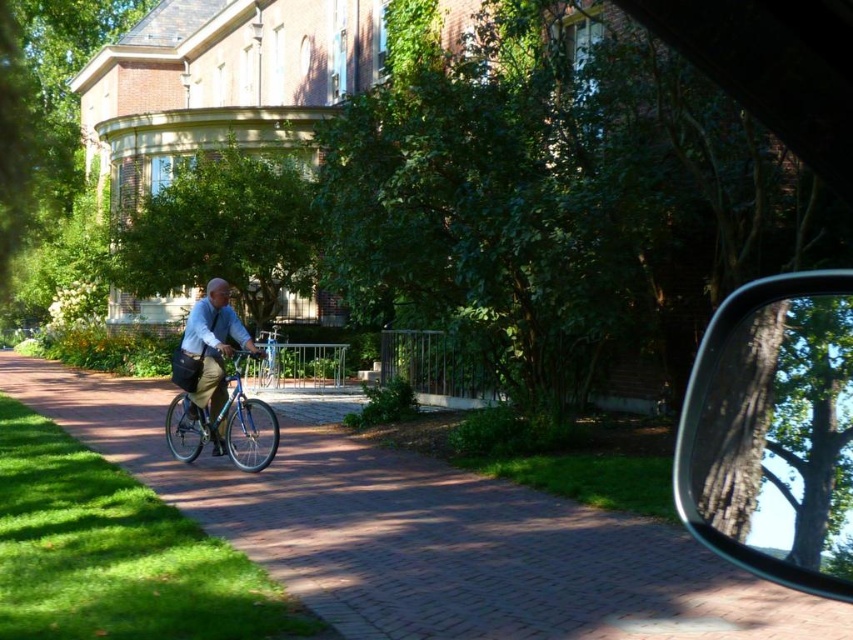
Question: Which point is farther to the camera?

Choices:
 (A) (247, 460)
 (B) (218, 324)
 (C) (247, 496)

Answer: (A)

Question: In this image, where is shiny blue bicycle at center located relative to blue metallic bicycle at center?

Choices:
 (A) left
 (B) right

Answer: (B)

Question: Among these points, which one is nearest to the camera?

Choices:
 (A) click(260, 358)
 (B) click(241, 353)
 (C) click(413, 634)

Answer: (C)

Question: Is shiny blue bicycle at center bigger than blue metallic bicycle at center?

Choices:
 (A) yes
 (B) no

Answer: (A)

Question: Which of the following is the closest to the observer?

Choices:
 (A) blue metallic bicycle at center
 (B) shiny blue bicycle at center

Answer: (B)

Question: Considering the relative positions of brick pavement at center and blue metallic bicycle at center in the image provided, where is brick pavement at center located with respect to blue metallic bicycle at center?

Choices:
 (A) left
 (B) right

Answer: (B)